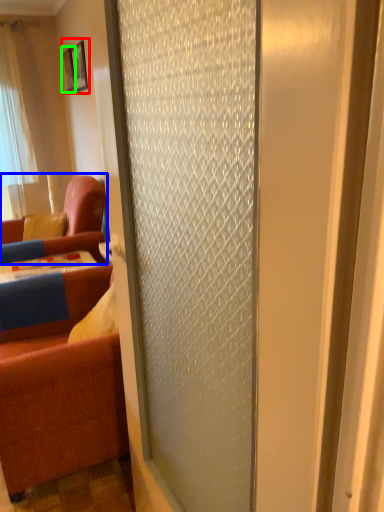
Question: Which object is positioned closest to picture frame (highlighted by a red box)? Select from studio couch (highlighted by a blue box) and picture frame (highlighted by a green box).

Choices:
 (A) studio couch
 (B) picture frame

Answer: (B)